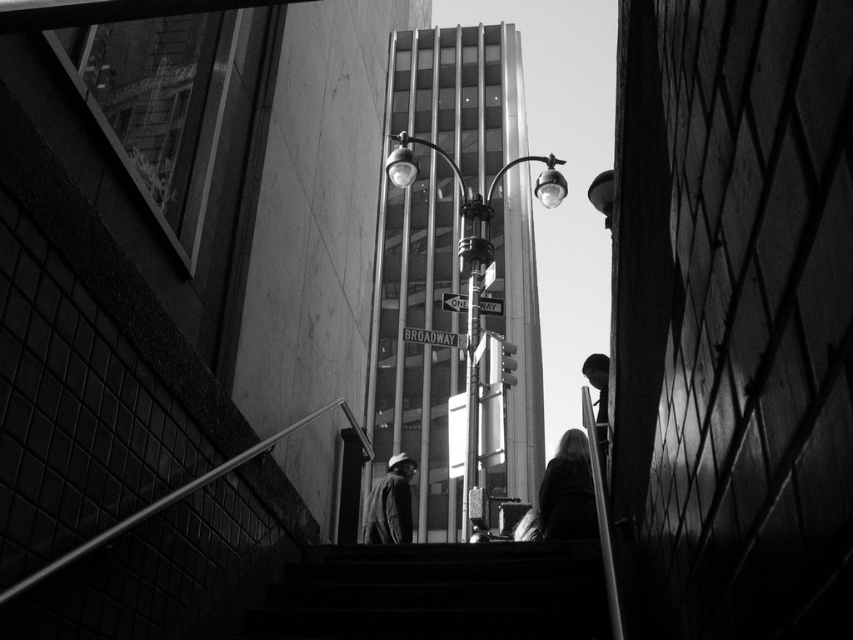
You are standing at the bottom of the stairs looking up at the cityscape. There are two points marked in the image. The first point is located at coordinates point (489, 604) and the second point is at point (596, 448). From your current position, which point is closer to you?

Point (596, 448) is closer to you because it is in front of point (489, 604) according to their spatial arrangement.

You are a delivery person carrying a package and need to place it on the ground between the matte gray jacket at center and the smooth black jacket at right. The package requires a minimum of 10 feet of space to safely place it. Based on the scene, can you fit the package between them?

The matte gray jacket at center and smooth black jacket at right are 9.73 feet apart from each other. Since the required space is 10 feet, the package cannot be safely placed between them as there is insufficient space.